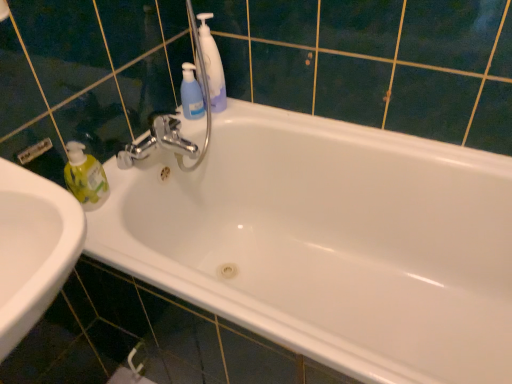
Question: Is white glossy bathtub at center directly adjacent to blue translucent bottle at upper center?

Choices:
 (A) yes
 (B) no

Answer: (B)

Question: Considering the relative sizes of white glossy bathtub at center and blue translucent bottle at upper center in the image provided, is white glossy bathtub at center smaller than blue translucent bottle at upper center?

Choices:
 (A) yes
 (B) no

Answer: (B)

Question: Is white glossy bathtub at center shorter than blue translucent bottle at upper center?

Choices:
 (A) yes
 (B) no

Answer: (B)

Question: Does white glossy bathtub at center appear on the left side of blue translucent bottle at upper center?

Choices:
 (A) no
 (B) yes

Answer: (A)

Question: Is white glossy bathtub at center closer to the viewer compared to blue translucent bottle at upper center?

Choices:
 (A) no
 (B) yes

Answer: (B)

Question: Which is correct: white glossy bathtub at center is inside blue translucent bottle at upper center, or outside of it?

Choices:
 (A) inside
 (B) outside

Answer: (B)

Question: From the image's perspective, is white glossy bathtub at center located above or below blue translucent bottle at upper center?

Choices:
 (A) above
 (B) below

Answer: (B)

Question: Considering the positions of point (186, 249) and point (195, 112), is point (186, 249) closer or farther from the camera than point (195, 112)?

Choices:
 (A) farther
 (B) closer

Answer: (A)

Question: Considering the positions of white glossy bathtub at center and blue translucent bottle at upper center in the image, is white glossy bathtub at center bigger or smaller than blue translucent bottle at upper center?

Choices:
 (A) big
 (B) small

Answer: (A)

Question: From a real-world perspective, relative to white glossy bathtub at center, is blue translucent bottle at upper center vertically above or below?

Choices:
 (A) above
 (B) below

Answer: (A)

Question: In terms of height, does blue translucent bottle at upper center look taller or shorter compared to white glossy bathtub at center?

Choices:
 (A) short
 (B) tall

Answer: (A)

Question: Is blue translucent bottle at upper center in front of or behind white glossy bathtub at center in the image?

Choices:
 (A) behind
 (B) front

Answer: (A)

Question: From the image's perspective, is blue translucent bottle at upper center positioned above or below white glossy bathtub at center?

Choices:
 (A) above
 (B) below

Answer: (A)

Question: Which is correct: white glossy bathtub at center is inside translucent blue pump bottle at upper center, or outside of it?

Choices:
 (A) inside
 (B) outside

Answer: (B)

Question: Is white glossy bathtub at center in front of or behind translucent blue pump bottle at upper center in the image?

Choices:
 (A) front
 (B) behind

Answer: (A)